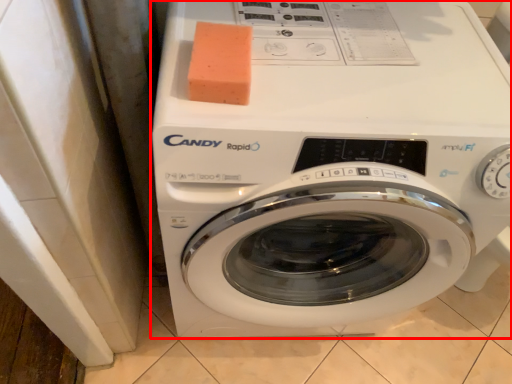
Question: From the image, what is the correct spatial relationship of washing machine (annotated by the red box) in relation to soap?

Choices:
 (A) left
 (B) right

Answer: (B)